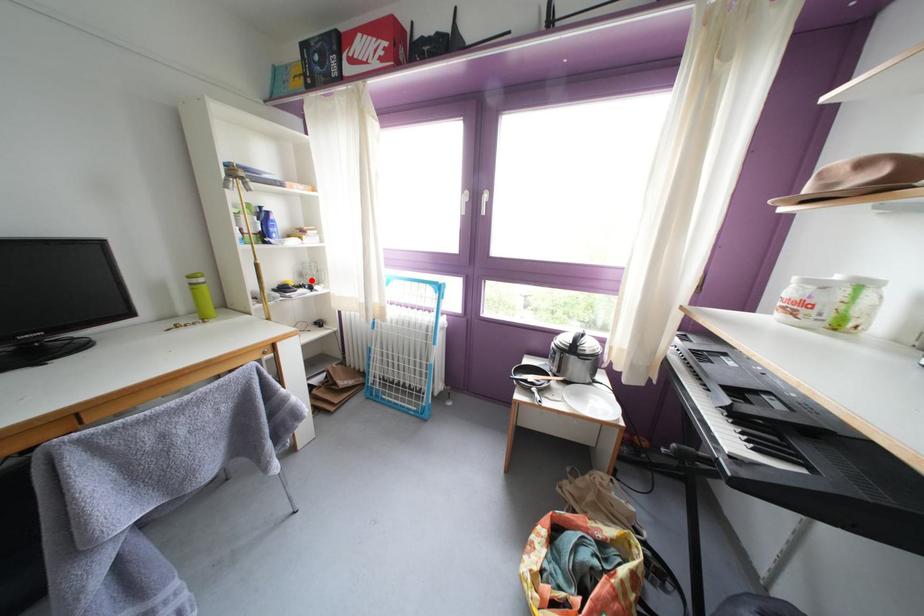
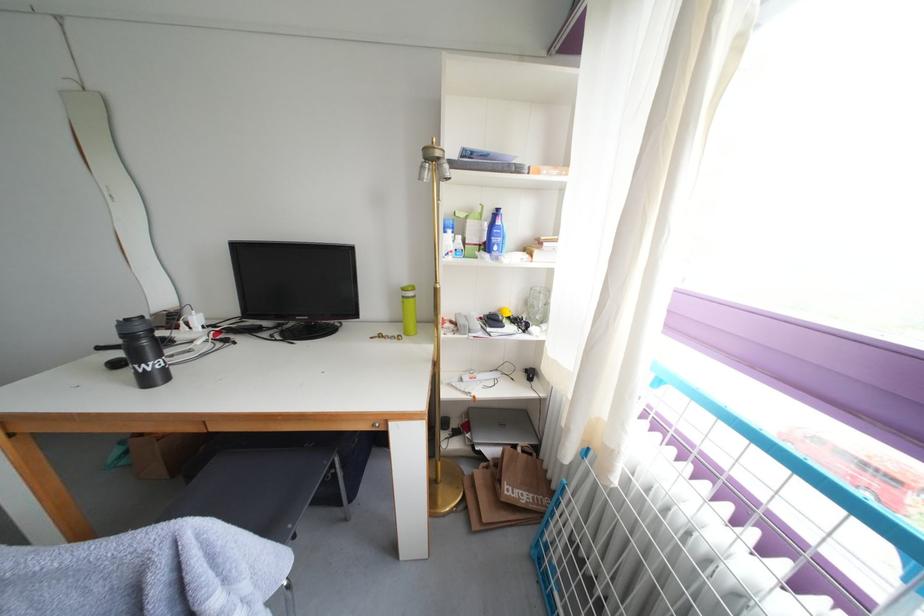
Question: I am providing you with two images of the same scene from different viewpoints. A red point is marked on the first image. At the location where the point appears in image 1, is it still visible in image 2?

Choices:
 (A) Yes
 (B) No

Answer: (A)